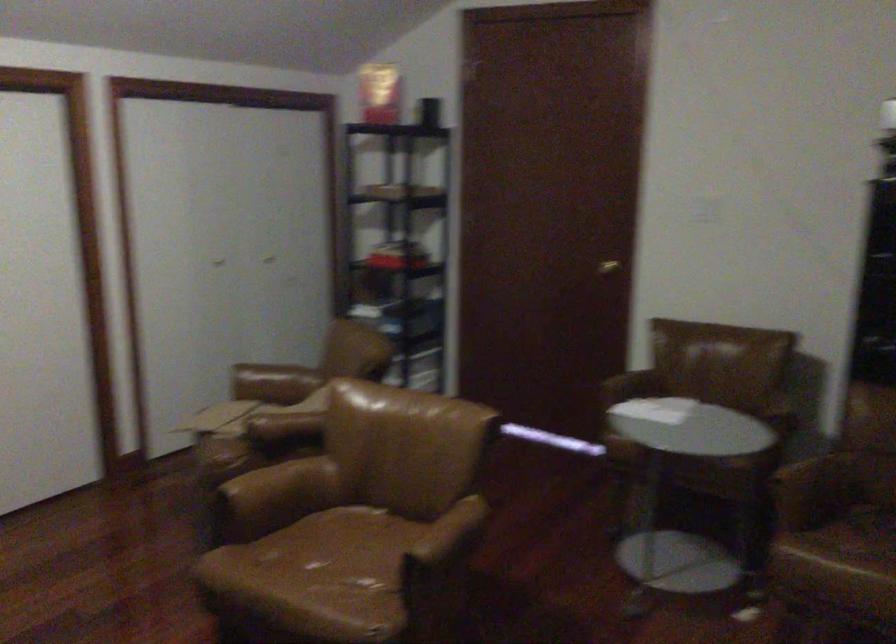
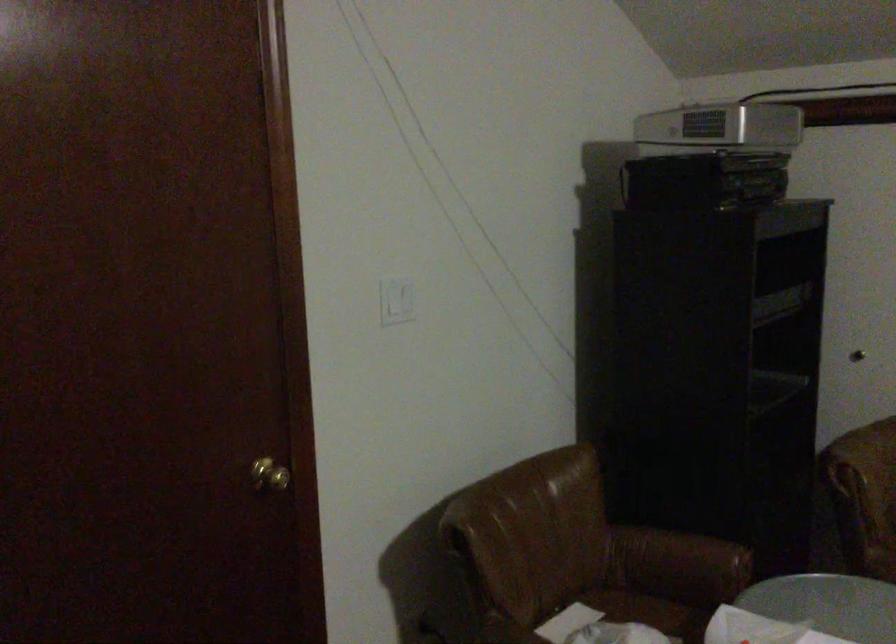
Find the pixel in the second image that matches [719,194] in the first image.

(397, 301)